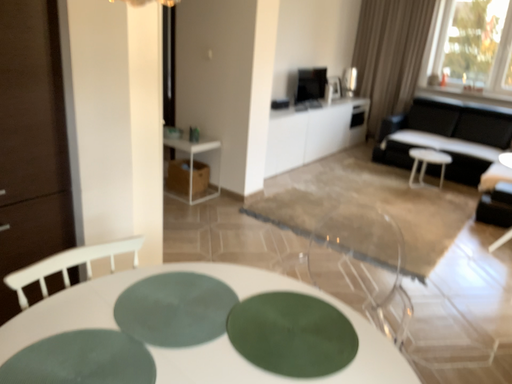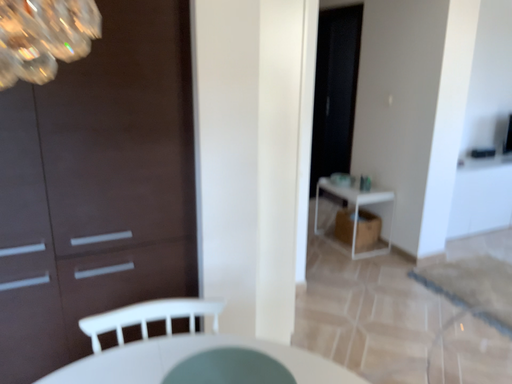
Question: How did the camera likely rotate when shooting the video?

Choices:
 (A) rotated upward
 (B) rotated downward

Answer: (A)